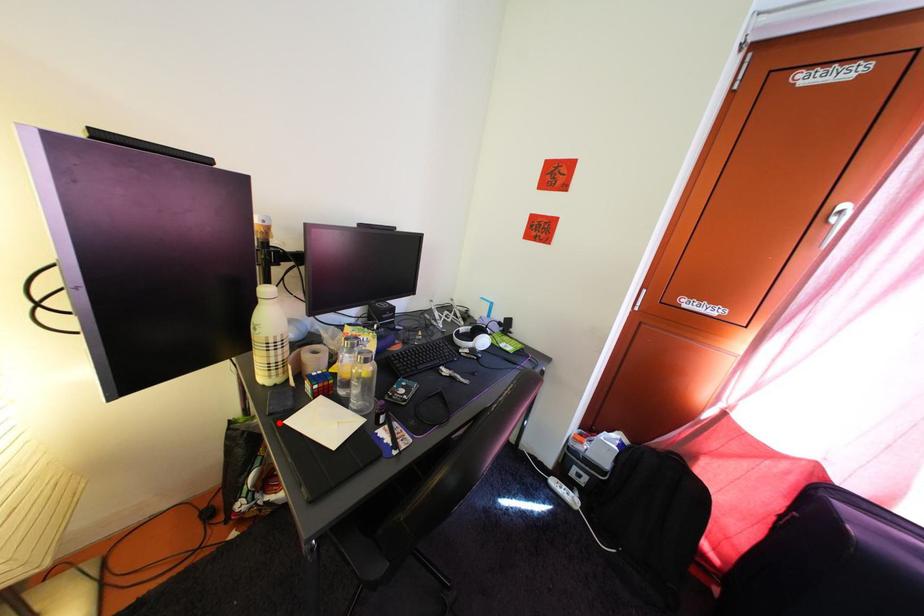
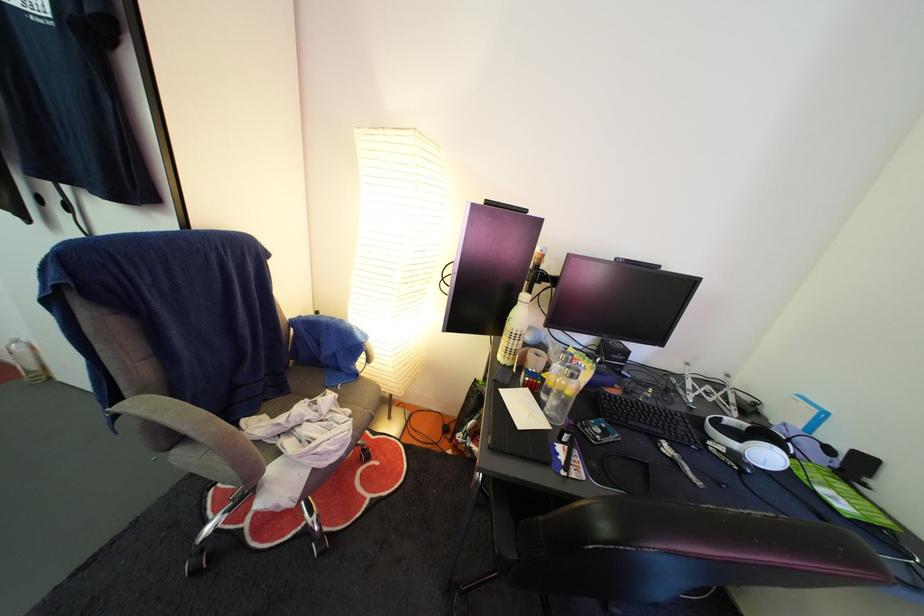
Locate, in the second image, the point that corresponds to the highlighted location in the first image.

(504, 389)